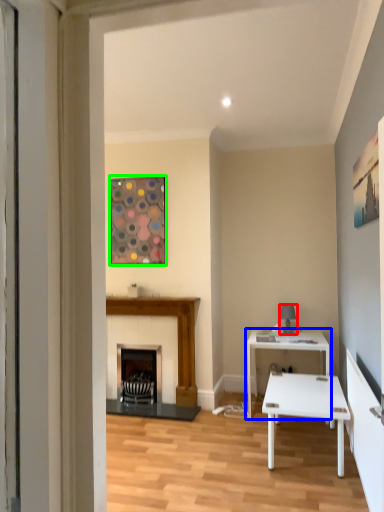
Question: Based on their relative distances, which object is farther from lamp (highlighted by a red box)? Choose from table (highlighted by a blue box) and picture frame (highlighted by a green box).

Choices:
 (A) table
 (B) picture frame

Answer: (B)